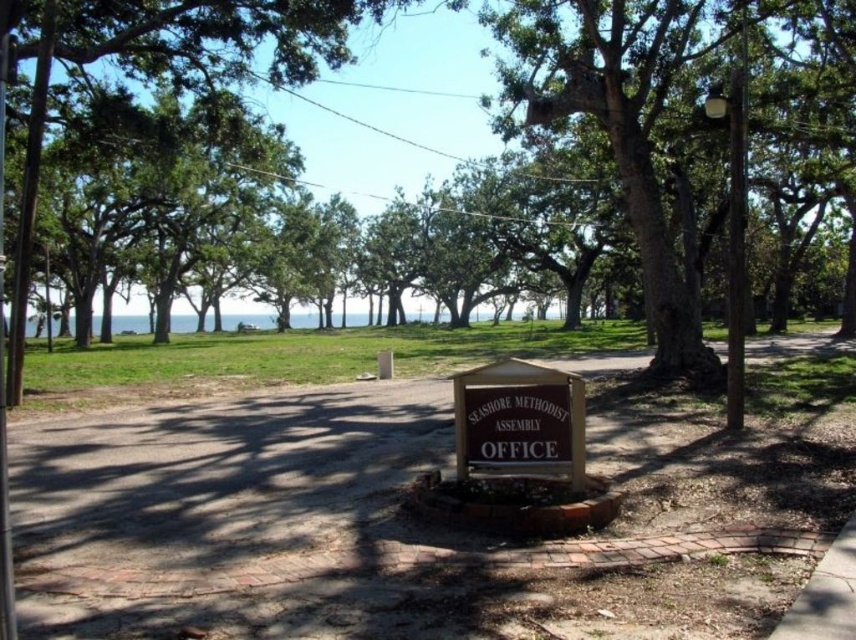
Does brown brick pavement at center have a larger size compared to brown wooden sign at center?

Indeed, brown brick pavement at center has a larger size compared to brown wooden sign at center.

Which is in front, point (566, 602) or point (583, 422)?

Point (566, 602)

The image size is (856, 640). I want to click on brown brick pavement at center, so click(x=407, y=522).

At what (x,y) coordinates should I click in order to perform the action: click on brown brick pavement at center. Please return your answer as a coordinate pair (x, y). The image size is (856, 640). Looking at the image, I should click on (407, 522).